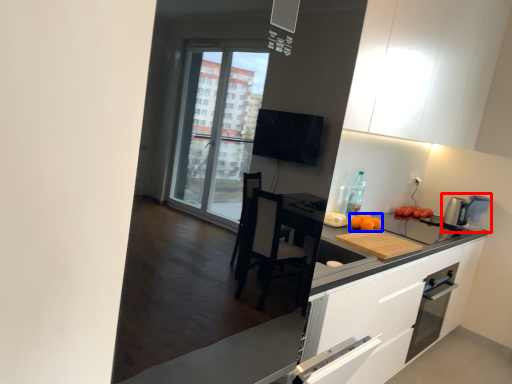
Question: Which object is further to the camera taking this photo, coffee machine (highlighted by a red box) or orange (highlighted by a blue box)?

Choices:
 (A) coffee machine
 (B) orange

Answer: (A)